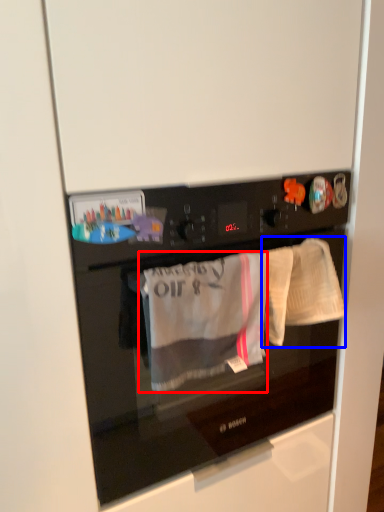
Question: Which object appears farthest to the camera in this image, clothing (highlighted by a red box) or baby clothe (highlighted by a blue box)?

Choices:
 (A) clothing
 (B) baby clothe

Answer: (B)